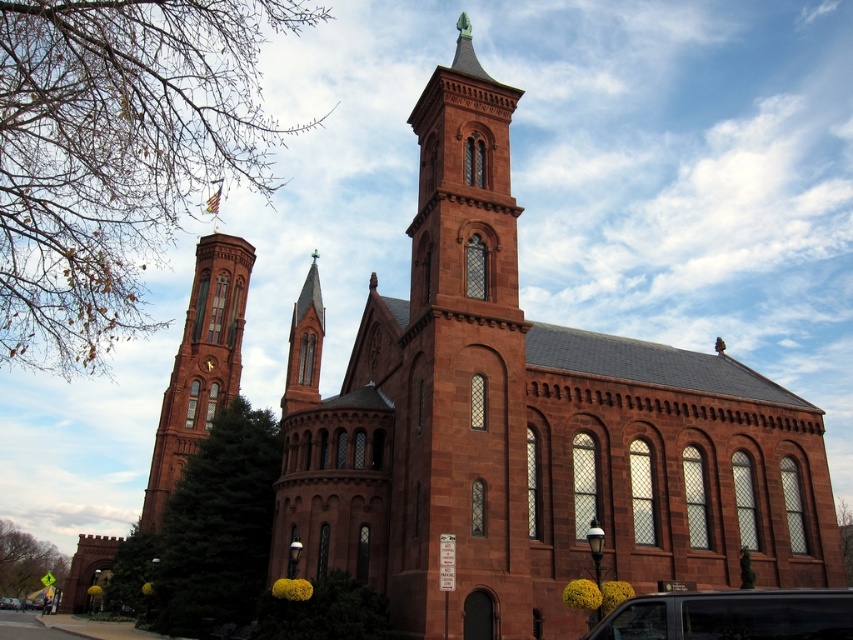
You are standing in front of the grand historic building and notice the matte brick tower at left and the black matte van at lower right. Which object is positioned higher in the scene?

The matte brick tower at left is positioned higher than the black matte van at lower right.

You are standing in front of the grand historic building and want to take a photo focusing on the red stone tower at center. To ensure the tower is centered in your shot, where should you position yourself relative to the building?

The red stone tower at center is located at coordinates point (x=462, y=372), so you should position yourself directly in front of the tower to center it in your photo.

You are standing in front of a historic building and want to take a photo of the red stone tower at center. If your camera can focus on objects up to 35 meters away, will you need to adjust your position to capture the tower clearly?

The red stone tower at center is 37.12 meters from camera, which is beyond the camera focus limit of 35 meters. You need to move closer to ensure the tower is in focus.